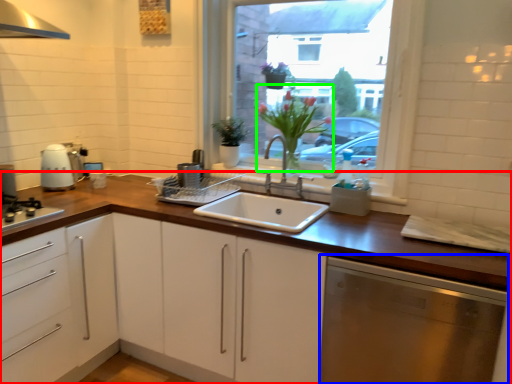
Question: Estimate the real-world distances between objects in this image. Which object is closer to cabinetry (highlighted by a red box), dish washer (highlighted by a blue box) or flower (highlighted by a green box)?

Choices:
 (A) dish washer
 (B) flower

Answer: (A)